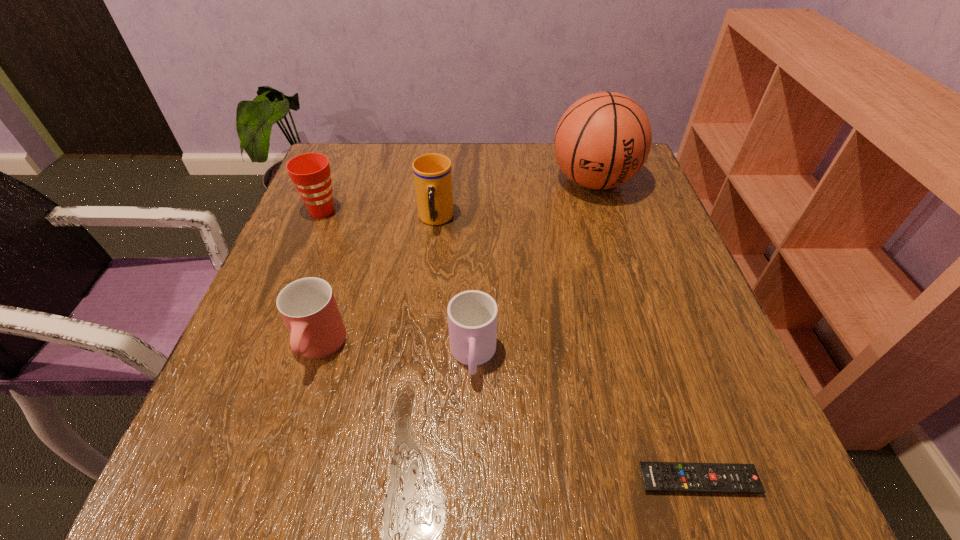
Image resolution: width=960 pixels, height=540 pixels. What are the coordinates of `free region at the near edge of the desktop` in the screenshot? It's located at (646, 461).

Image resolution: width=960 pixels, height=540 pixels. What are the coordinates of `vacant space at the left edge` in the screenshot? It's located at (345, 219).

Identify the location of vacant position at the right edge of the desktop. (663, 292).

In the image, there is a desktop. At what (x,y) coordinates should I click in order to perform the action: click on vacant space at the far left corner. Please return your answer as a coordinate pair (x, y). The height and width of the screenshot is (540, 960). Looking at the image, I should click on (337, 172).

Where is `vacant space at the near left corner`? This screenshot has height=540, width=960. vacant space at the near left corner is located at coordinates (252, 452).

Find the location of a particular element. free location at the far right corner of the desktop is located at coordinates (646, 186).

The width and height of the screenshot is (960, 540). In the image, there is a desktop. Identify the location of vacant area at the near right corner. (692, 463).

The image size is (960, 540). I want to click on free space that is in between the remote control and the tallest object, so [x=646, y=330].

Locate an element on the screen. The image size is (960, 540). free point between the leftmost object and the third cup from left to right is located at coordinates (379, 215).

You are a GUI agent. You are given a task and a screenshot of the screen. Output one action in this format:
    pyautogui.click(x=<x>, y=<y>)
    Task: Click on the vacant space in between the second object from left to right and the basketball
    The image size is (960, 540).
    Given the screenshot: What is the action you would take?
    pyautogui.click(x=456, y=265)